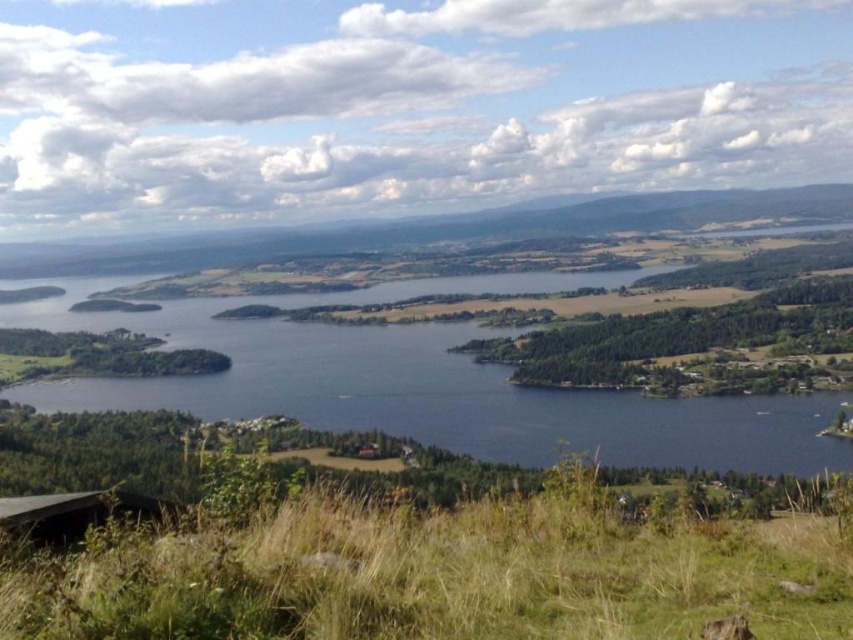
You are standing at the grassy hillside in the foreground and want to walk to the lake. You see two points marked on the image, point [650,556] and point [427,371]. Which point should you head towards to reach the lake faster?

Point [650,556] is closer to the viewer than point [427,371], so heading towards point [650,556] would allow you to reach the lake faster.

You are standing at the edge of the lake and see the green grassy at lower center and the blue water at center. Which one is closer to you?

The green grassy at lower center is closer to you than the blue water at center because it is not as tall as the blue water at center, indicating its proximity.